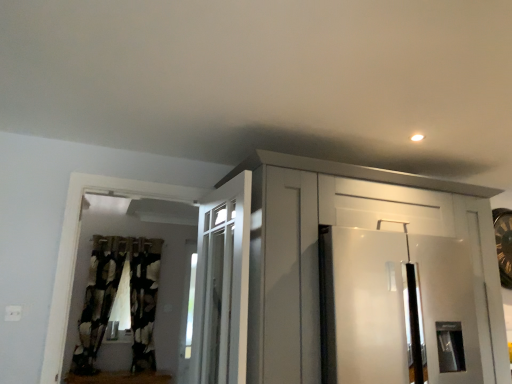
Question: Are white glossy refrigerator at right and black textured curtain at left, arranged as the 1th curtain when viewed from the right, making contact?

Choices:
 (A) yes
 (B) no

Answer: (B)

Question: Can you confirm if white glossy refrigerator at right is positioned to the left of black textured curtain at left, arranged as the 1th curtain when viewed from the right?

Choices:
 (A) no
 (B) yes

Answer: (A)

Question: Can you confirm if white glossy refrigerator at right is taller than black textured curtain at left, arranged as the 1th curtain when viewed from the right?

Choices:
 (A) yes
 (B) no

Answer: (B)

Question: Does white glossy refrigerator at right turn towards black textured curtain at left, the 2th curtain positioned from the left?

Choices:
 (A) yes
 (B) no

Answer: (B)

Question: Is white glossy refrigerator at right positioned before black textured curtain at left, arranged as the 1th curtain when viewed from the right?

Choices:
 (A) yes
 (B) no

Answer: (A)

Question: In the image, is white glossy refrigerator at right on the left side or the right side of black textured curtain at left, the 2th curtain positioned from the left?

Choices:
 (A) right
 (B) left

Answer: (A)

Question: In the image, is white glossy refrigerator at right positioned in front of or behind black textured curtain at left, the 2th curtain positioned from the left?

Choices:
 (A) behind
 (B) front

Answer: (B)

Question: In terms of size, does white glossy refrigerator at right appear bigger or smaller than black textured curtain at left, the 2th curtain positioned from the left?

Choices:
 (A) big
 (B) small

Answer: (A)

Question: From the image's perspective, is white glossy refrigerator at right positioned above or below black textured curtain at left, arranged as the 1th curtain when viewed from the right?

Choices:
 (A) above
 (B) below

Answer: (A)

Question: Considering their positions, is white glossy cabinet at upper center located in front of or behind black textured curtain at left, the 2th curtain positioned from the right?

Choices:
 (A) behind
 (B) front

Answer: (B)

Question: From their relative heights in the image, would you say white glossy cabinet at upper center is taller or shorter than black textured curtain at left, the 2th curtain positioned from the right?

Choices:
 (A) short
 (B) tall

Answer: (A)

Question: In terms of size, does white glossy cabinet at upper center appear bigger or smaller than black textured curtain at left, the 2th curtain positioned from the right?

Choices:
 (A) small
 (B) big

Answer: (B)

Question: Based on their positions, is white glossy cabinet at upper center located to the left or right of black textured curtain at left, which appears as the 1th curtain when viewed from the left?

Choices:
 (A) right
 (B) left

Answer: (A)

Question: In terms of size, does black textured curtain at left, the 2th curtain positioned from the left, appear bigger or smaller than white glossy cabinet at upper center?

Choices:
 (A) small
 (B) big

Answer: (A)

Question: Based on their positions, is black textured curtain at left, arranged as the 1th curtain when viewed from the right, located to the left or right of white glossy cabinet at upper center?

Choices:
 (A) left
 (B) right

Answer: (A)